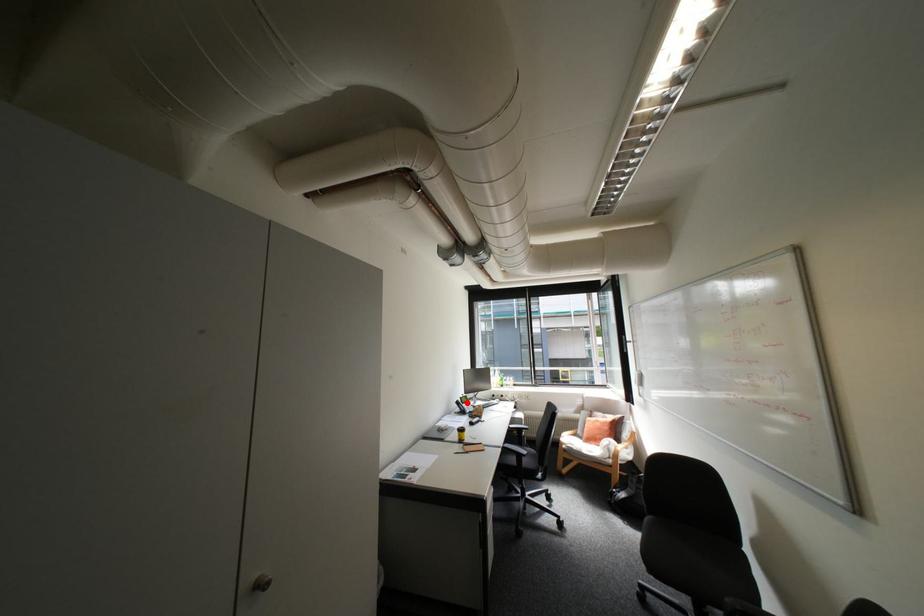
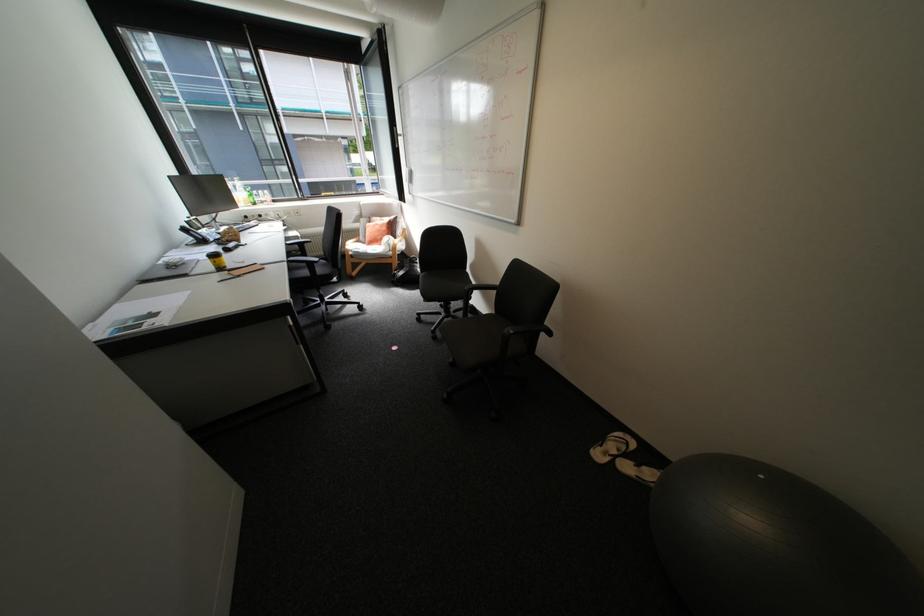
In the second image, find the point that corresponds to the highlighted location in the first image.

(195, 230)